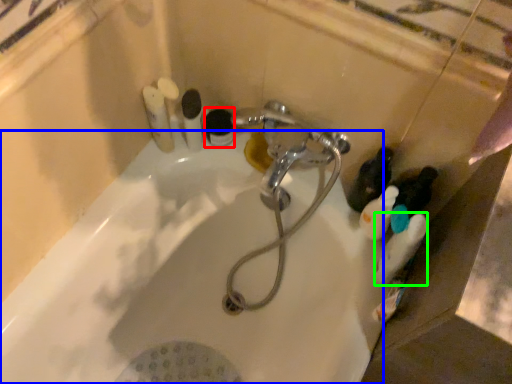
Question: Based on their relative distances, which object is farther from toiletry (highlighted by a red box)? Choose from bath (highlighted by a blue box) and cleaning product (highlighted by a green box).

Choices:
 (A) bath
 (B) cleaning product

Answer: (B)